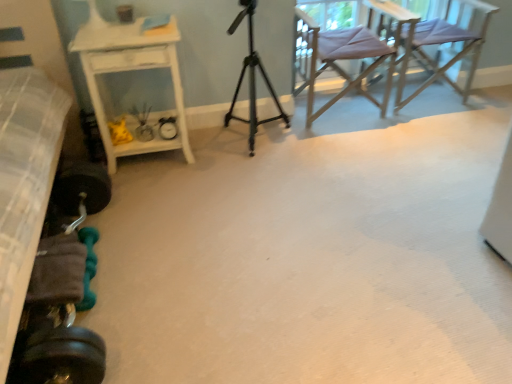
Question: Is textured gray bed at left a part of metallic tripod at center?

Choices:
 (A) no
 (B) yes

Answer: (A)

Question: Is metallic tripod at center bigger than textured gray bed at left?

Choices:
 (A) yes
 (B) no

Answer: (B)

Question: Considering the relative sizes of metallic tripod at center and textured gray bed at left in the image provided, is metallic tripod at center shorter than textured gray bed at left?

Choices:
 (A) no
 (B) yes

Answer: (B)

Question: Considering the relative positions of metallic tripod at center and textured gray bed at left in the image provided, is metallic tripod at center to the left of textured gray bed at left from the viewer's perspective?

Choices:
 (A) no
 (B) yes

Answer: (A)

Question: Can you confirm if metallic tripod at center is positioned to the right of textured gray bed at left?

Choices:
 (A) no
 (B) yes

Answer: (B)

Question: Is metallic tripod at center wider than textured gray bed at left?

Choices:
 (A) yes
 (B) no

Answer: (B)

Question: From the image's perspective, is white glossy side table at left below purple fabric chair at upper right, the first chair viewed from the left?

Choices:
 (A) no
 (B) yes

Answer: (B)

Question: Is white glossy side table at left at the right side of purple fabric chair at upper right, the first chair viewed from the left?

Choices:
 (A) yes
 (B) no

Answer: (B)

Question: Is white glossy side table at left thinner than purple fabric chair at upper right, the first chair viewed from the left?

Choices:
 (A) yes
 (B) no

Answer: (A)

Question: From a real-world perspective, is white glossy side table at left physically below purple fabric chair at upper right, the first chair viewed from the left?

Choices:
 (A) yes
 (B) no

Answer: (A)

Question: From the image's perspective, is white glossy side table at left above purple fabric chair at upper right, the first chair viewed from the left?

Choices:
 (A) yes
 (B) no

Answer: (B)

Question: From a real-world perspective, does white glossy side table at left stand above purple fabric chair at upper right, which appears as the second chair when viewed from the right?

Choices:
 (A) no
 (B) yes

Answer: (A)

Question: Is light purple fabric chair at upper right, the 1th chair when ordered from right to left, shorter than white glossy side table at left?

Choices:
 (A) no
 (B) yes

Answer: (A)